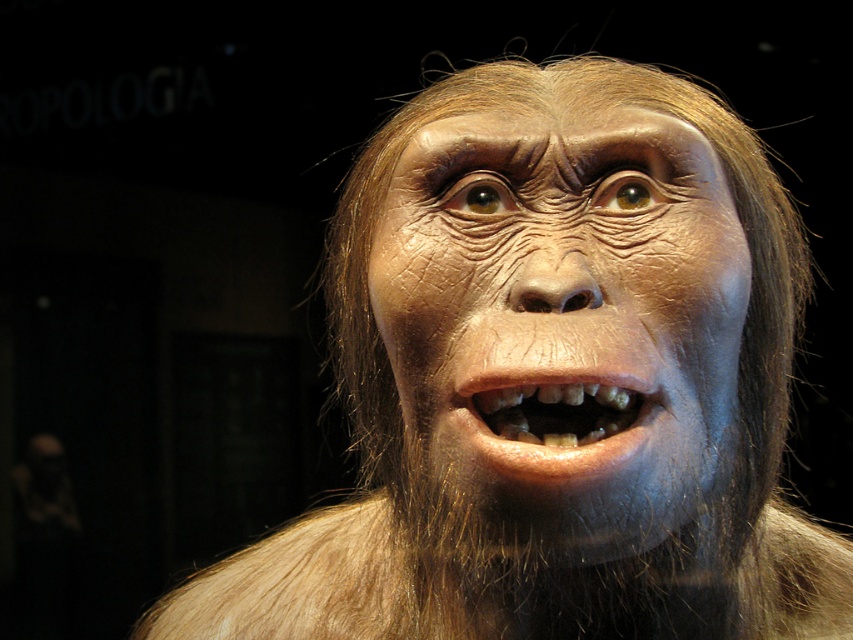
You are an anthropologist examining the model of a hominid. The matte brown face at center is positioned at coordinates 0.503 on the x and 0.664 on the y. If you want to place a label indicating its position, where should you place it relative to the face?

The label should be placed at the coordinates 0.503 on the x and 0.664 on the y, which corresponds to the center of the matte brown face at center, as that is its 2D location.

You are an anthropologist examining the model of an early human ancestor. You notice the matte brown face at center and the brown textured teeth at center. Which object is positioned to the right in the image?

The matte brown face at center is positioned to the right of the brown textured teeth at center.

You are an anthropologist examining the model of the hominid. You notice a specific point at coordinates point (566, 321). Based on the scene description, where is this point located on the model?

The point (566, 321) is on the matte brown face at center of the hominid model.